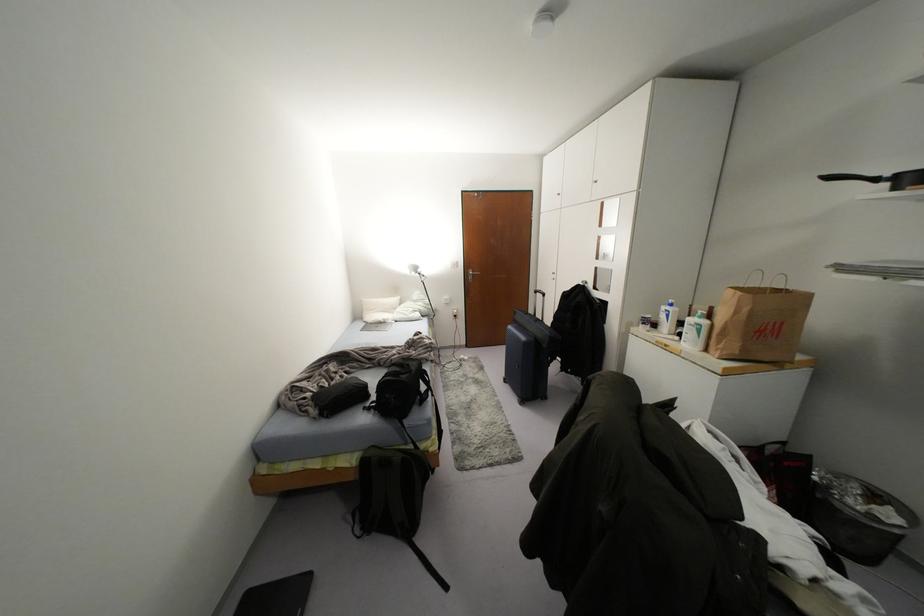
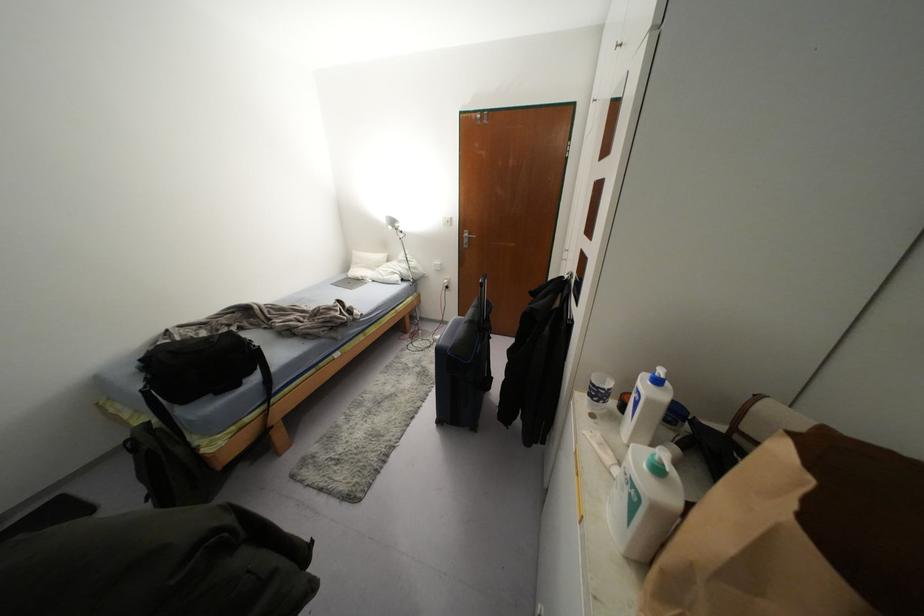
The point at (670, 305) is marked in the first image. Where is the corresponding point in the second image?

(658, 381)